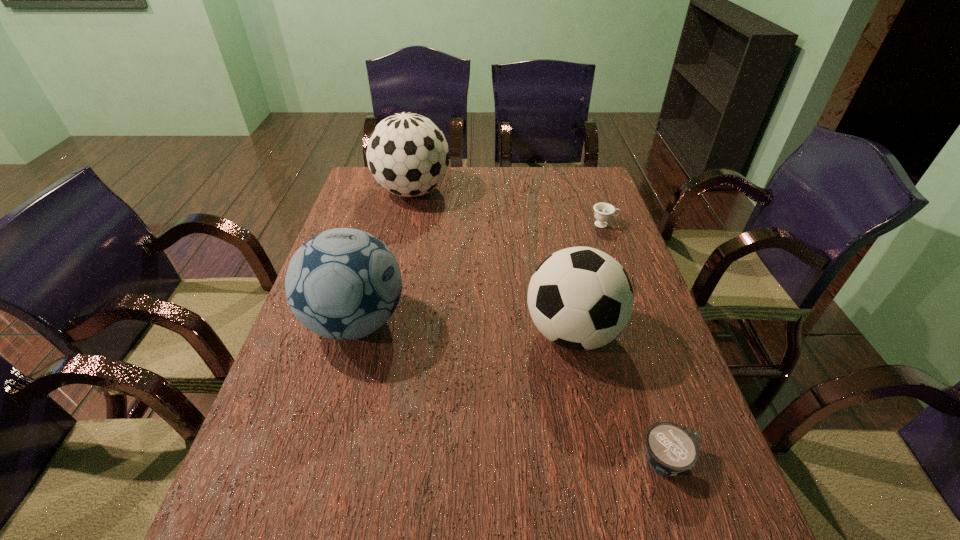
The image size is (960, 540). Find the location of `yogurt located in the right edge section of the desktop`. yogurt located in the right edge section of the desktop is located at coordinates (671, 448).

I want to click on object that is at the far left corner, so click(x=408, y=155).

Find the location of a particular element. The height and width of the screenshot is (540, 960). blank space at the far edge is located at coordinates (484, 194).

The image size is (960, 540). I want to click on free space at the left edge, so click(x=338, y=382).

Locate an element on the screen. vacant area at the right edge of the desktop is located at coordinates (642, 345).

The width and height of the screenshot is (960, 540). I want to click on free space at the far left corner, so click(x=361, y=181).

Where is `vacant space that's between the farthest object and the fourth nearest object`? vacant space that's between the farthest object and the fourth nearest object is located at coordinates (509, 208).

You are a GUI agent. You are given a task and a screenshot of the screen. Output one action in this format:
    pyautogui.click(x=<x>, y=<y>)
    Task: Click on the vacant space in between the rightmost soccer ball and the farthest object
    Image resolution: width=960 pixels, height=540 pixels.
    Given the screenshot: What is the action you would take?
    pyautogui.click(x=492, y=262)

Where is `vacant space that is in between the teacup and the yogurt`? The image size is (960, 540). vacant space that is in between the teacup and the yogurt is located at coordinates (636, 342).

Locate an element on the screen. This screenshot has width=960, height=540. free area in between the rightmost soccer ball and the farthest object is located at coordinates (492, 262).